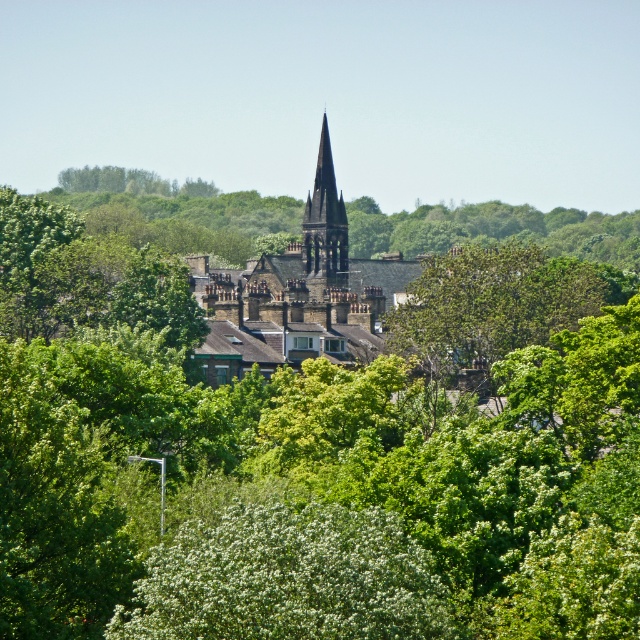
Question: Which object is farther from the camera taking this photo?

Choices:
 (A) dark gray stone tower at center
 (B) dark gray stone church steeple at center
 (C) green leafy tree at center

Answer: (A)

Question: Which point is farther to the camera?

Choices:
 (A) green leafy tree at center
 (B) dark gray stone tower at center

Answer: (B)

Question: Which point appears closest to the camera in this image?

Choices:
 (A) (540, 273)
 (B) (312, 288)

Answer: (A)

Question: Does dark gray stone church steeple at center appear on the right side of dark gray stone tower at center?

Choices:
 (A) yes
 (B) no

Answer: (B)

Question: Observing the image, what is the correct spatial positioning of green leafy tree at center in reference to dark gray stone tower at center?

Choices:
 (A) left
 (B) right

Answer: (B)

Question: From the image, what is the correct spatial relationship of dark gray stone church steeple at center in relation to green leafy tree at center?

Choices:
 (A) above
 (B) below

Answer: (A)